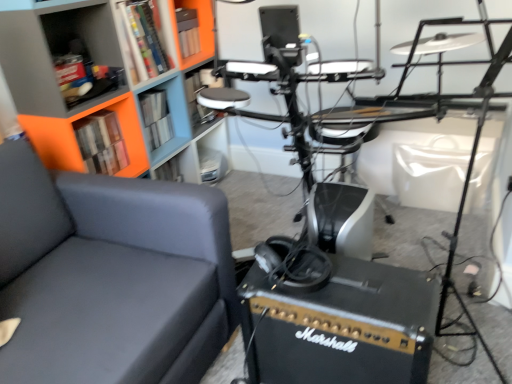
Question: Is matte plastic shelf at center, placed as the first shelf when sorted from back to front, inside or outside of matte plastic shelf at upper left, the 1th shelf in the left-to-right sequence?

Choices:
 (A) inside
 (B) outside

Answer: (B)

Question: Relative to matte plastic shelf at upper left, arranged as the 2th shelf when viewed from the right, is matte plastic shelf at center, the 2th shelf when ordered from left to right, in front or behind?

Choices:
 (A) front
 (B) behind

Answer: (B)

Question: Which is nearer to the gray fabric couch at left?

Choices:
 (A) orange matte bookcase at upper left
 (B) hardcover book at upper left, which is counted as the second book, starting from the back
 (C) matte plastic shelf at center, which is the 1th shelf from right to left
 (D) hardcover book at upper left, which ranks as the 1th book in back-to-front order
 (E) black matte marshall amplifier at lower right

Answer: (E)

Question: Which object is positioned farthest from the hardcover book at upper left, arranged as the 1th book when viewed from the front?

Choices:
 (A) matte plastic shelf at center, the 2th shelf when ordered from left to right
 (B) orange matte bookcase at upper left
 (C) black matte marshall amplifier at lower right
 (D) gray fabric couch at left
 (E) hardcover book at upper left, which ranks as the 1th book in back-to-front order

Answer: (C)